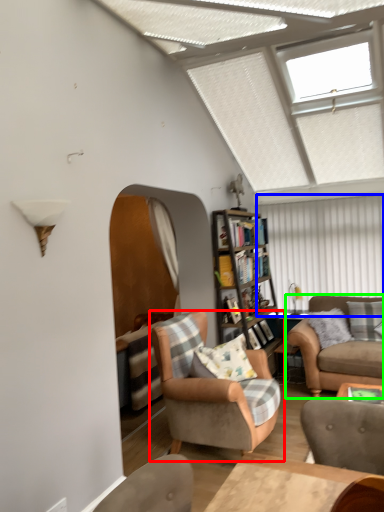
Question: Considering the real-world distances, which object is farthest from chair (highlighted by a red box)? shutter (highlighted by a blue box) or studio couch (highlighted by a green box)?

Choices:
 (A) shutter
 (B) studio couch

Answer: (A)